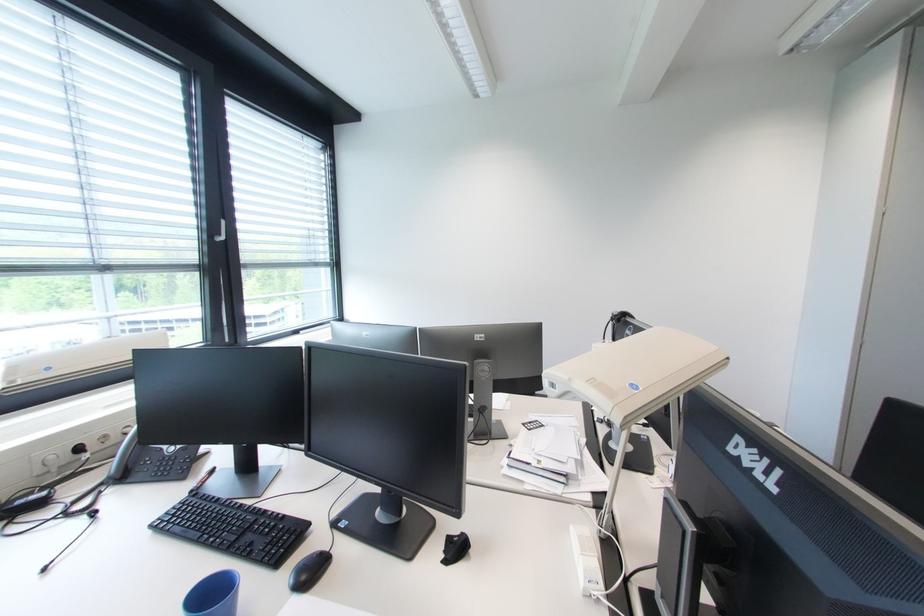
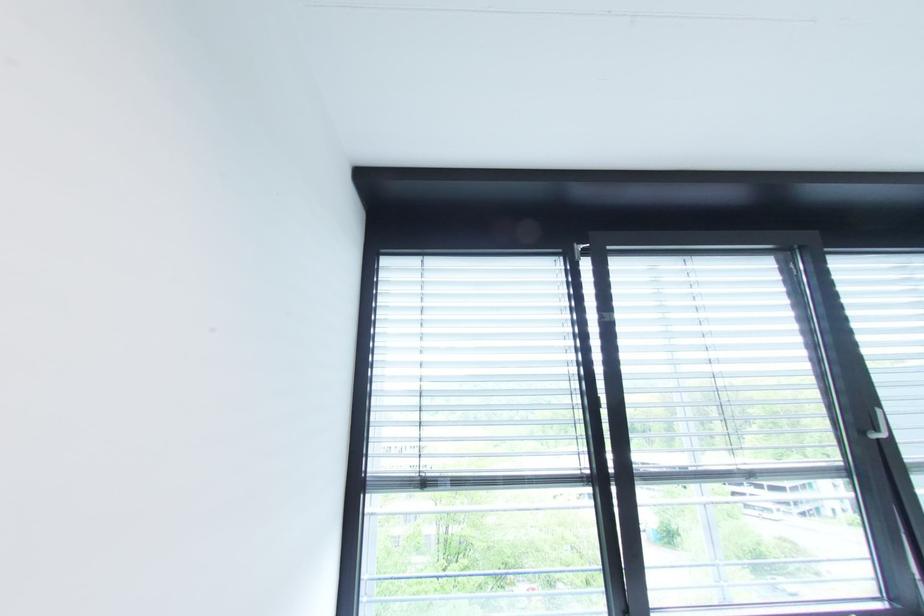
In the second image, find the point that corresponds to [228,240] in the first image.

(889, 437)